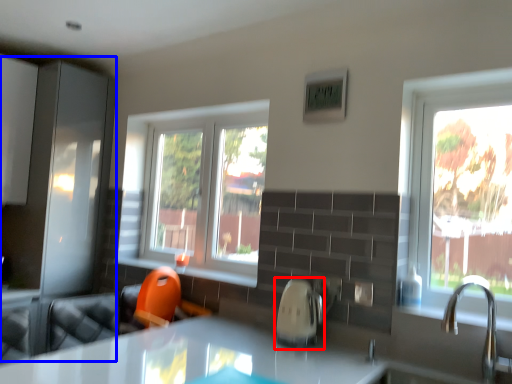
Question: Which of the following is the closest to the observer, appliance (highlighted by a red box) or screen door (highlighted by a blue box)?

Choices:
 (A) appliance
 (B) screen door

Answer: (A)